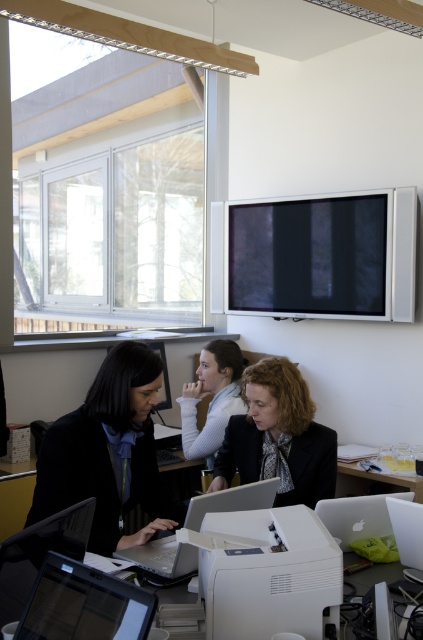
Question: Which object is the farthest from the white plastic table at lower right?

Choices:
 (A) matte black monitor at upper center
 (B) matte black jacket at center

Answer: (A)

Question: Which of the following is the farthest from the observer?

Choices:
 (A) black glossy laptop at lower left
 (B) black matte suit at lower left
 (C) white matte sweater at center

Answer: (C)

Question: Which of the following is the closest to the observer?

Choices:
 (A) (186, 404)
 (B) (195, 516)
 (C) (398, 547)
 (D) (246, 588)

Answer: (D)

Question: In this image, where is black matte suit at lower left located relative to black glossy laptop at lower left?

Choices:
 (A) right
 (B) left

Answer: (B)

Question: Is black matte suit at lower left to the right of matte black jacket at center from the viewer's perspective?

Choices:
 (A) yes
 (B) no

Answer: (B)

Question: Can you confirm if white matte printer at center is bigger than white matte sweater at center?

Choices:
 (A) no
 (B) yes

Answer: (A)